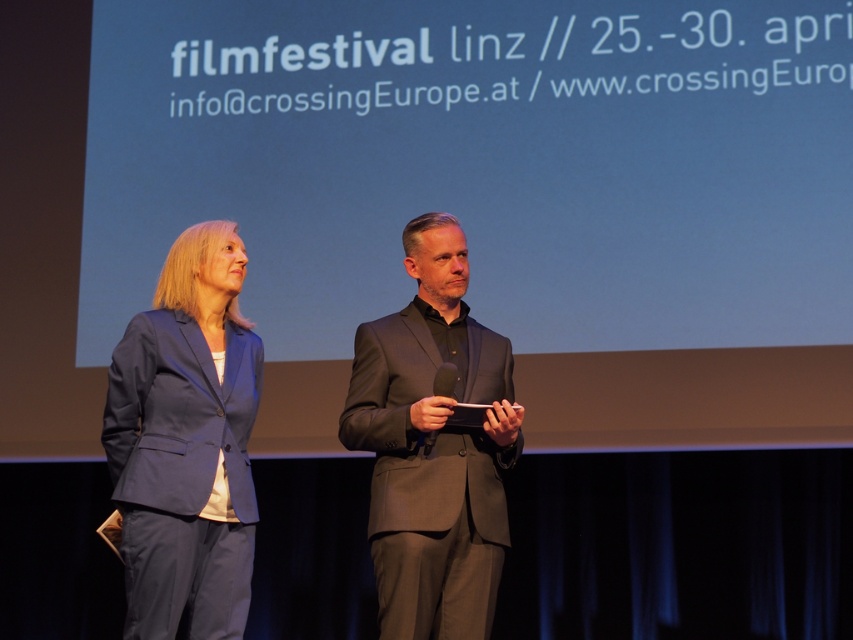
Question: Is matte blue suit at left to the right of matte black suit at center from the viewer's perspective?

Choices:
 (A) yes
 (B) no

Answer: (B)

Question: Observing the image, what is the correct spatial positioning of matte blue suit at left in reference to matte black suit at center?

Choices:
 (A) right
 (B) left

Answer: (B)

Question: Which point is closer to the camera?

Choices:
 (A) (196, 282)
 (B) (387, 461)

Answer: (B)

Question: Is the position of matte blue suit at left more distant than that of matte black suit at center?

Choices:
 (A) yes
 (B) no

Answer: (B)